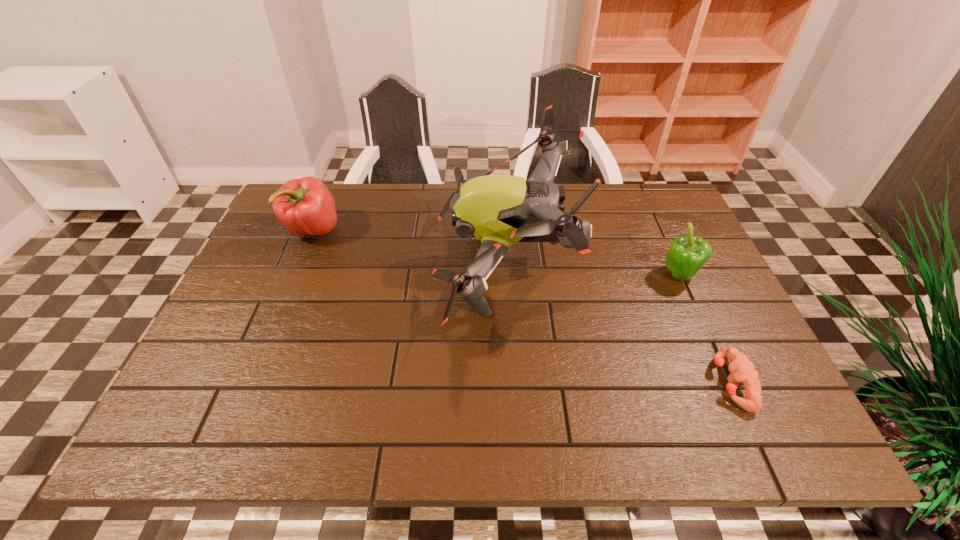
At what (x,y) coordinates should I click in order to perform the action: click on the second object from left to right. Please return your answer as a coordinate pair (x, y). The width and height of the screenshot is (960, 540). Looking at the image, I should click on (498, 211).

I want to click on the tallest object, so click(498, 211).

Where is `the farther bell pepper`? This screenshot has height=540, width=960. the farther bell pepper is located at coordinates (305, 207).

Where is `the leftmost object`? This screenshot has height=540, width=960. the leftmost object is located at coordinates (305, 207).

In order to click on the nearer bell pepper in this screenshot , I will do `click(687, 254)`.

The image size is (960, 540). What are the coordinates of `puncher` in the screenshot? It's located at (742, 371).

Locate an element on the screen. The height and width of the screenshot is (540, 960). free space located 0.120m on the front-facing side of the third object from right to left is located at coordinates (391, 261).

You are a GUI agent. You are given a task and a screenshot of the screen. Output one action in this format:
    pyautogui.click(x=<x>, y=<y>)
    Task: Click on the blank space located on the front-facing side of the third object from right to left
    
    Given the screenshot: What is the action you would take?
    [x=353, y=261]

At what (x,y) coordinates should I click in order to perform the action: click on free space located 0.250m on the front-facing side of the third object from right to left. Please return your answer as a coordinate pair (x, y). The width and height of the screenshot is (960, 540). Looking at the image, I should click on (342, 261).

I want to click on vacant region located on the front of the farther bell pepper, so click(300, 261).